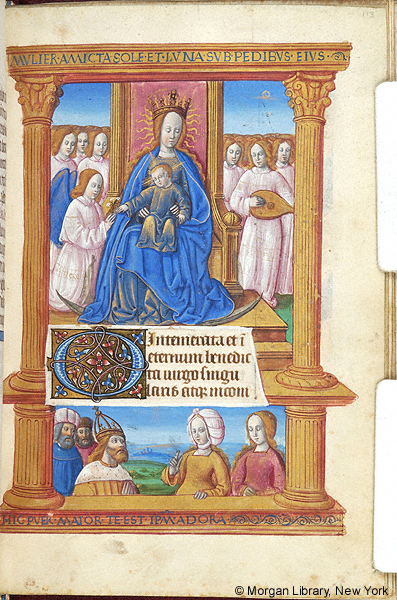
This screenshot has width=397, height=600. Find the location of `upper pillars`. upper pillars is located at coordinates (39, 303), (306, 318).